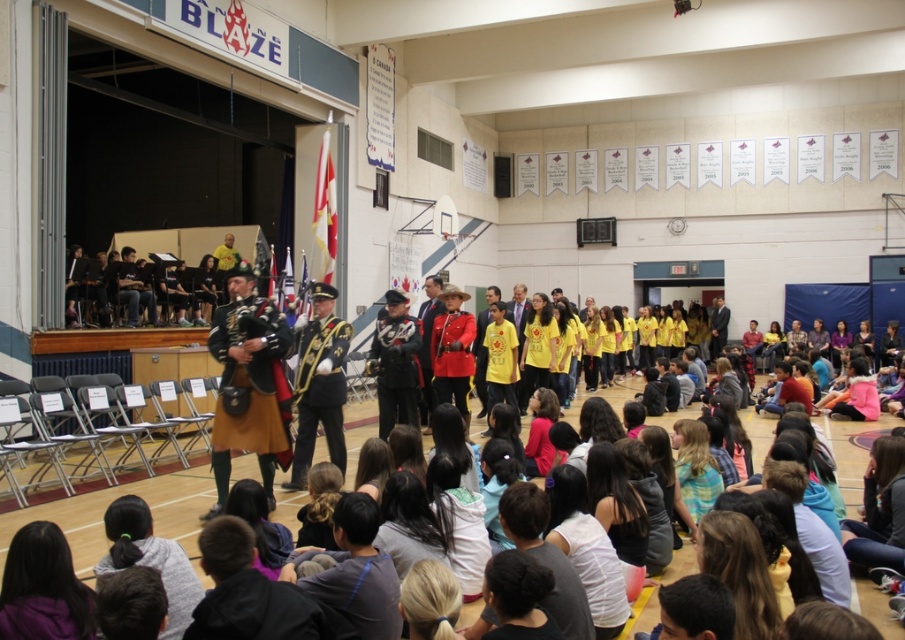
You are organizing a display in a museum and have two items to place on a shelf. The items are the brown leather kilt at center and the black fabric at left. According to the image, which item requires more space on the shelf?

The black fabric at left requires more space on the shelf because the brown leather kilt at center occupies less space than it.

You are a photographer at the event and need to capture a photo of both the red uniform at center and the dark brown leather jacket at center. Which object should you focus on first to ensure it appears in the foreground?

The red uniform at center is shorter than the dark brown leather jacket at center, so you should focus on the dark brown leather jacket at center first to ensure it appears in the foreground.

You are organizing a parade and need to know if the brown leather kilt at center can fit through a doorway next to the shiny gold uniform at center. The doorway is 1 meter wide. Can the kilt fit through the doorway?

The brown leather kilt at center might be wider than the shiny gold uniform at center, but without knowing the exact width of the kilt, it is uncertain if it can fit through the 1 meter wide doorway. Additional measurements are needed.